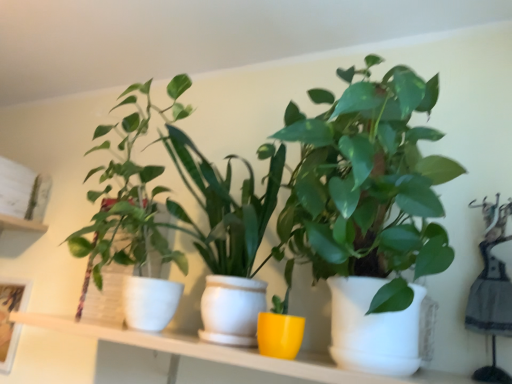
Question: Is white ceramic shelf at center outside of woven basket plant at left, placed as the second houseplant when sorted from right to left?

Choices:
 (A) no
 (B) yes

Answer: (B)

Question: From the image's perspective, is white ceramic shelf at center over woven basket plant at left, placed as the second houseplant when sorted from right to left?

Choices:
 (A) no
 (B) yes

Answer: (A)

Question: Is white ceramic shelf at center in front of woven basket plant at left, the 1th houseplant viewed from the left?

Choices:
 (A) yes
 (B) no

Answer: (A)

Question: From a real-world perspective, is white ceramic shelf at center on top of woven basket plant at left, the 1th houseplant viewed from the left?

Choices:
 (A) yes
 (B) no

Answer: (B)

Question: Is white ceramic shelf at center beside woven basket plant at left, the 1th houseplant viewed from the left?

Choices:
 (A) yes
 (B) no

Answer: (B)

Question: In terms of size, does white ceramic shelf at center appear bigger or smaller than woven basket plant at left, the 1th houseplant viewed from the left?

Choices:
 (A) big
 (B) small

Answer: (A)

Question: Is point (279, 370) closer or farther from the camera than point (178, 102)?

Choices:
 (A) closer
 (B) farther

Answer: (A)

Question: From the image's perspective, is white ceramic shelf at center located above or below woven basket plant at left, placed as the second houseplant when sorted from right to left?

Choices:
 (A) below
 (B) above

Answer: (A)

Question: In the image, is white ceramic shelf at center positioned in front of or behind woven basket plant at left, placed as the second houseplant when sorted from right to left?

Choices:
 (A) front
 (B) behind

Answer: (A)

Question: Based on their positions, is green matte plant at center, which is the first houseplant in right-to-left order, located to the left or right of woven basket plant at left, placed as the second houseplant when sorted from right to left?

Choices:
 (A) right
 (B) left

Answer: (A)

Question: Considering the positions of point (265, 205) and point (140, 243), is point (265, 205) closer or farther from the camera than point (140, 243)?

Choices:
 (A) closer
 (B) farther

Answer: (A)

Question: From a real-world perspective, is green matte plant at center, which is the 2th houseplant from left to right, positioned above or below woven basket plant at left, placed as the second houseplant when sorted from right to left?

Choices:
 (A) below
 (B) above

Answer: (B)

Question: From the image's perspective, relative to woven basket plant at left, the 1th houseplant viewed from the left, is green matte plant at center, which is the 2th houseplant from left to right, above or below?

Choices:
 (A) below
 (B) above

Answer: (B)

Question: Is green matte plant at center, which is the 2th houseplant from left to right, inside or outside of white ceramic shelf at center?

Choices:
 (A) inside
 (B) outside

Answer: (B)

Question: From the image's perspective, is green matte plant at center, which is the 2th houseplant from left to right, above or below white ceramic shelf at center?

Choices:
 (A) below
 (B) above

Answer: (B)